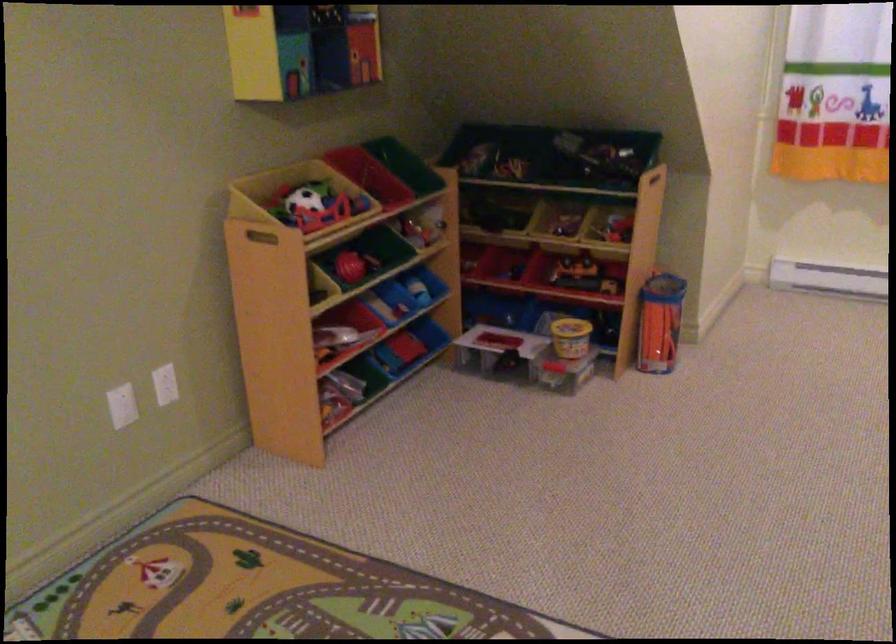
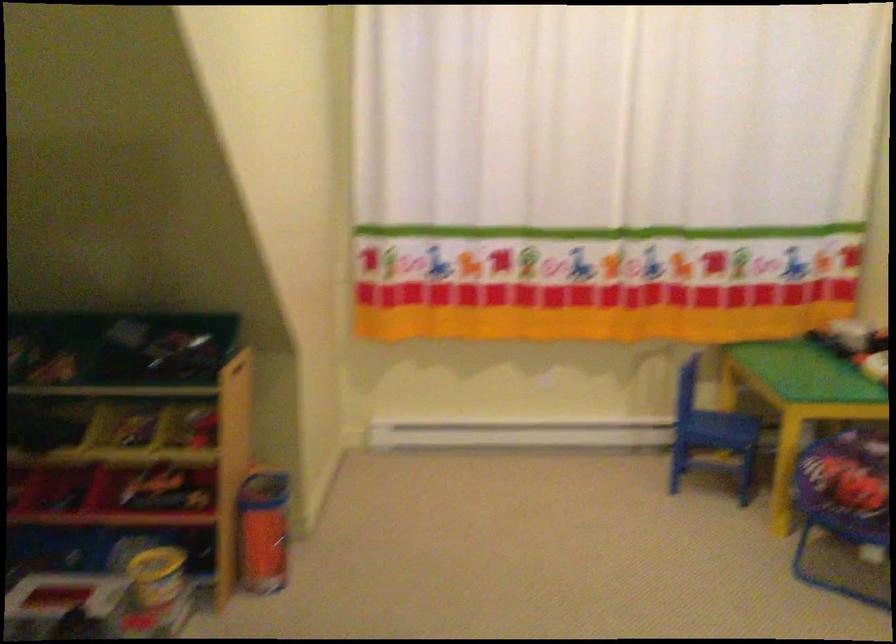
What movement of the cameraman would produce the second image?

The movement direction of the cameraman is right, forward.